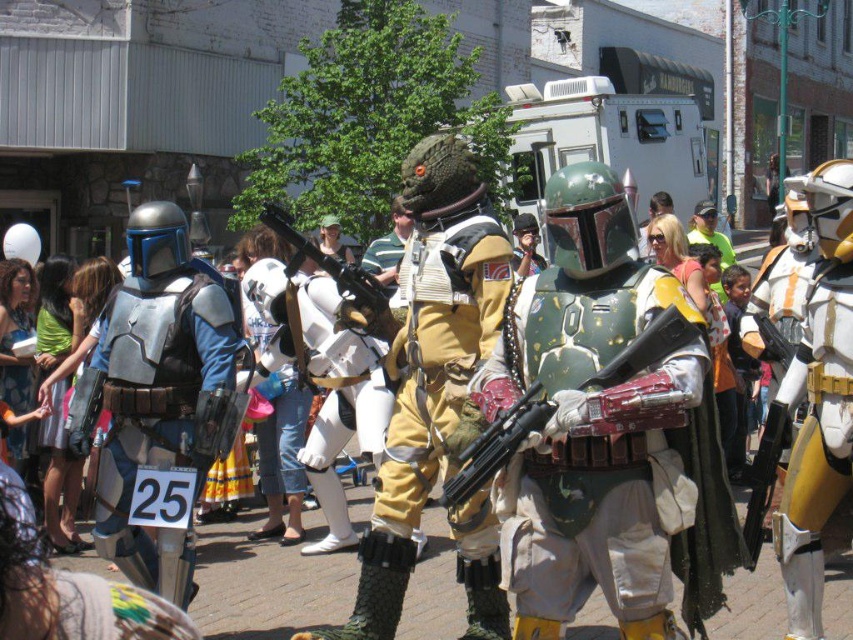
Question: Observing the image, what is the correct spatial positioning of leather-like armor at center in reference to brushed metal helmet at left?

Choices:
 (A) right
 (B) left

Answer: (A)

Question: Is leather-like armor at center further to camera compared to brushed metal helmet at left?

Choices:
 (A) no
 (B) yes

Answer: (A)

Question: Is leather-like armor at center thinner than brushed metal helmet at left?

Choices:
 (A) yes
 (B) no

Answer: (A)

Question: Which of the following is the farthest from the observer?

Choices:
 (A) brushed metal helmet at left
 (B) metallic green armor at center
 (C) leather-like armor at center

Answer: (A)

Question: Which object is the farthest from the leather-like armor at center?

Choices:
 (A) brushed metal helmet at left
 (B) metallic green armor at center
 (C) brushed metal armor at left

Answer: (A)

Question: Estimate the real-world distances between objects in this image. Which object is closer to the brushed metal helmet at left?

Choices:
 (A) leather-like armor at center
 (B) metallic green armor at center
 (C) brushed metal armor at left

Answer: (C)